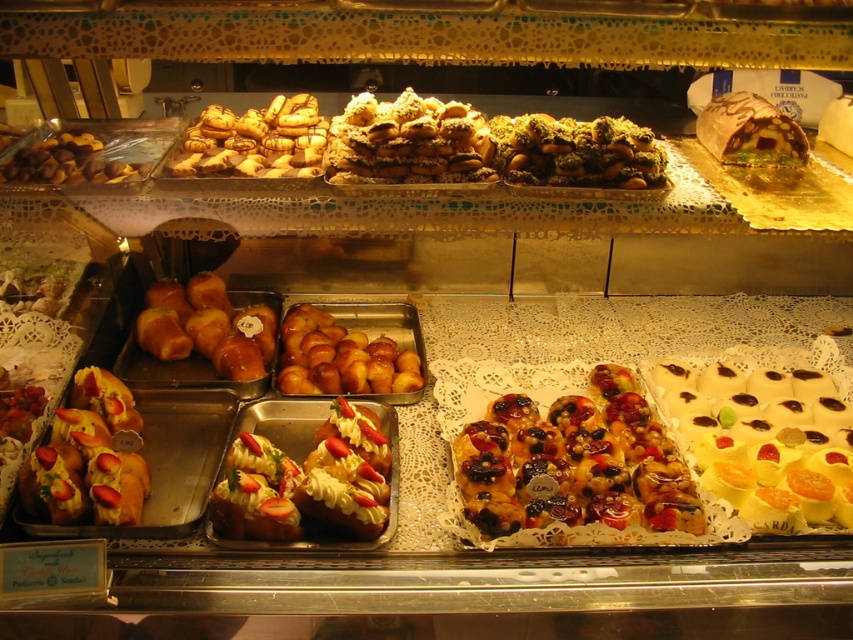
What do you see at coordinates (90, 458) in the screenshot? The width and height of the screenshot is (853, 640). I see `strawberry-topped bread at lower left` at bounding box center [90, 458].

Who is more forward, (125, 509) or (62, 131)?

Point (125, 509)

Where is `strawberry-topped bread at lower left`? The image size is (853, 640). strawberry-topped bread at lower left is located at coordinates (90, 458).

In the scene shown: Is chocolate glaze cake at upper right below brown matte nuts at left?

Actually, chocolate glaze cake at upper right is above brown matte nuts at left.

Who is more distant from viewer, (749,154) or (10,166)?

Positioned behind is point (749,154).

Who is more forward, (764, 116) or (41, 170)?

Point (41, 170) is more forward.

I want to click on chocolate glaze cake at upper right, so click(x=750, y=132).

Looking at this image, does strawberry-topped bread at lower left appear under matte golden croissant at upper left?

Indeed, strawberry-topped bread at lower left is positioned under matte golden croissant at upper left.

Can you confirm if strawberry-topped bread at lower left is smaller than matte golden croissant at upper left?

Yes, strawberry-topped bread at lower left is smaller than matte golden croissant at upper left.

The image size is (853, 640). Find the location of `strawberry-topped bread at lower left`. strawberry-topped bread at lower left is located at coordinates (90, 458).